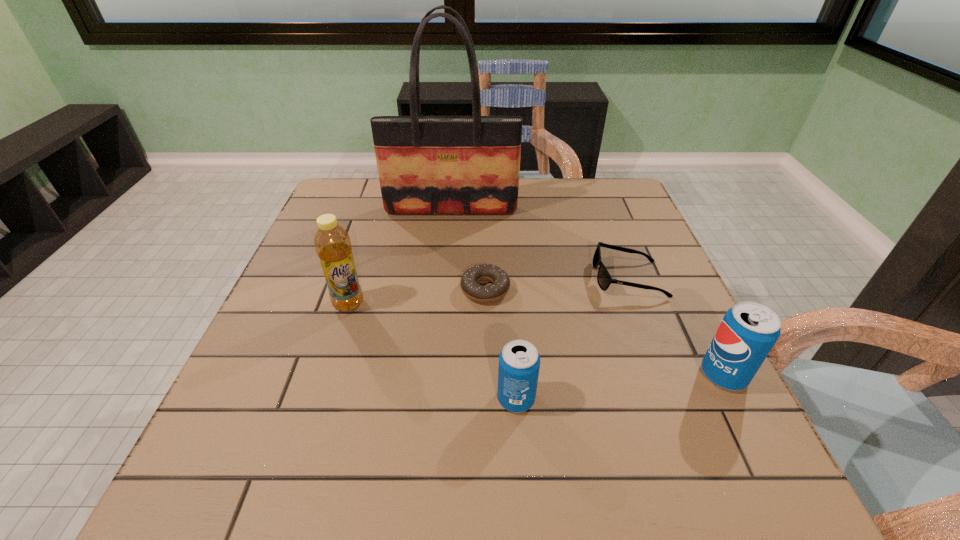
Locate an element on the screen. This screenshot has height=540, width=960. object that stands as the closest to the right soda can is located at coordinates coord(604,279).

This screenshot has height=540, width=960. I want to click on free location that satisfies the following two spatial constraints: 1. on the front-facing side of the third tallest object; 2. on the left side of the shopping bag, so click(x=436, y=375).

Locate an element on the screen. This screenshot has height=540, width=960. free region that satisfies the following two spatial constraints: 1. on the front-facing side of the sunglasses; 2. on the left side of the right soda can is located at coordinates (665, 375).

Locate an element on the screen. The image size is (960, 540). vacant region that satisfies the following two spatial constraints: 1. on the front side of the right soda can; 2. on the right side of the shortest object is located at coordinates (487, 375).